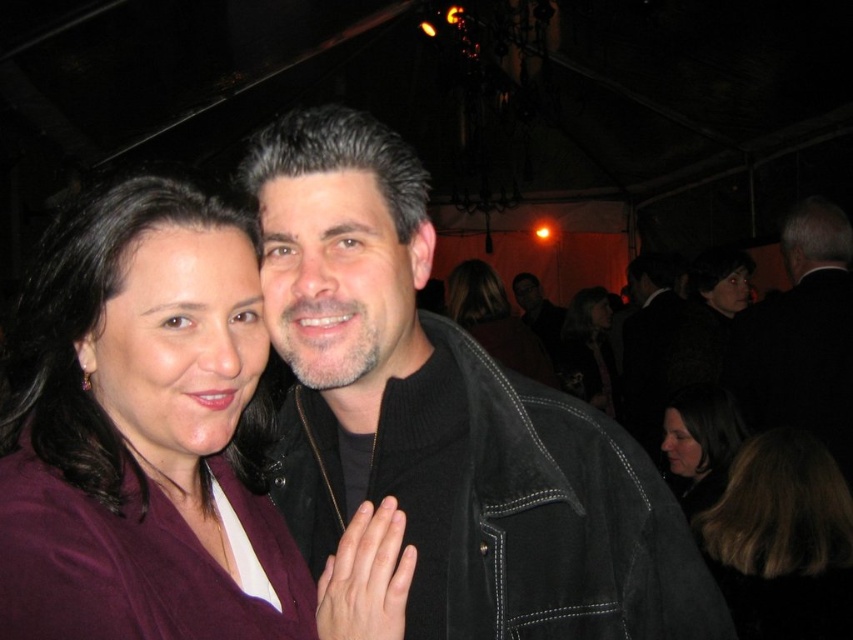
Question: Based on their relative distances, which object is farther from the dark brown hair at center?

Choices:
 (A) suede jacket at center
 (B) smooth black dress at center
 (C) black suede jacket at right
 (D) brown fuzzy hair at lower right

Answer: (A)

Question: Which of the following is the farthest from the observer?

Choices:
 (A) brown fuzzy hair at lower right
 (B) smooth black dress at center
 (C) purple fabric at center
 (D) suede jacket at center

Answer: (B)

Question: Which of the following is the farthest from the observer?

Choices:
 (A) (178, 404)
 (B) (566, 326)
 (C) (521, 324)
 (D) (775, 609)

Answer: (B)

Question: Is suede jacket at center positioned before dark brown hair at center?

Choices:
 (A) yes
 (B) no

Answer: (A)

Question: From the image, what is the correct spatial relationship of purple fabric at center in relation to dark brown hair at center?

Choices:
 (A) right
 (B) left

Answer: (B)

Question: Is suede jacket at center smaller than dark brown hair at center?

Choices:
 (A) yes
 (B) no

Answer: (A)